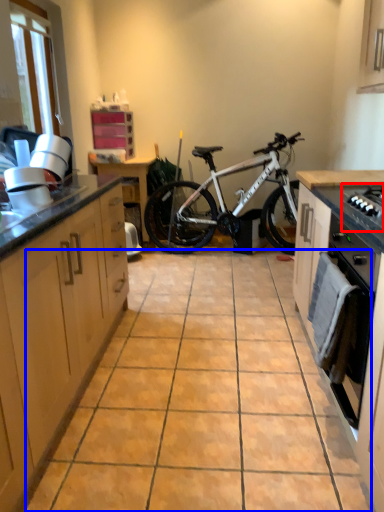
Question: Which object is further to the camera taking this photo, gas stove (highlighted by a red box) or ceramic tile (highlighted by a blue box)?

Choices:
 (A) gas stove
 (B) ceramic tile

Answer: (B)